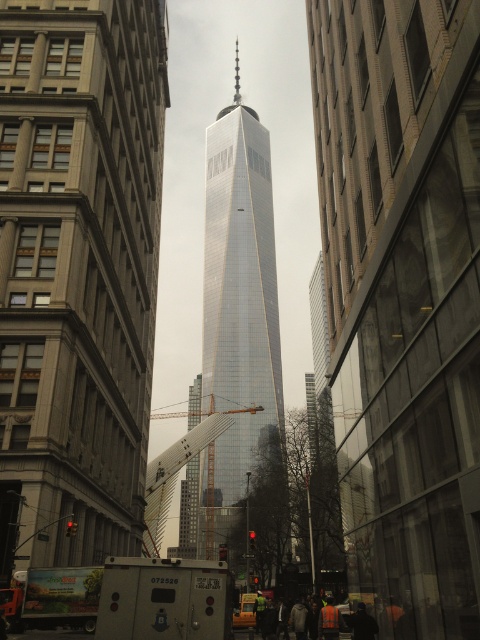
Does point (267, 410) come in front of point (166, 467)?

No, (267, 410) is further to viewer.

Is point (225, 109) farther from viewer compared to point (157, 518)?

That is True.

Locate an element on the screen. This screenshot has height=640, width=480. shiny glass skyscraper at center is located at coordinates (237, 312).

Does glassy reflective skyscraper at center appear over metallic silver crane at center?

Indeed, glassy reflective skyscraper at center is positioned over metallic silver crane at center.

Is point (110, 552) positioned after point (206, 428)?

No, it is in front of (206, 428).

Between point (151, 70) and point (206, 412), which one is positioned in front?

Point (151, 70) is in front.

The height and width of the screenshot is (640, 480). Identify the location of glassy reflective skyscraper at center. (78, 273).

What do you see at coordinates (78, 273) in the screenshot? I see `glassy reflective skyscraper at center` at bounding box center [78, 273].

Where is `glassy reflective skyscraper at center`? glassy reflective skyscraper at center is located at coordinates (78, 273).

Is point (34, 186) closer to camera compared to point (269, 392)?

That is True.

Identify the location of glassy reflective skyscraper at center. (78, 273).